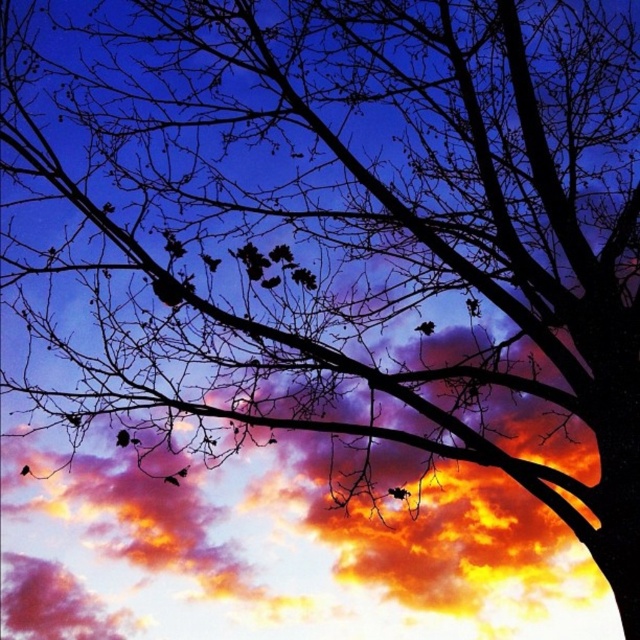
Is black matte bird at center taller than silhouette feather at lower left?

Yes.

Find the location of a particular element. black matte bird at center is located at coordinates (426, 326).

Find the location of a particular element. This screenshot has height=640, width=640. black matte bird at center is located at coordinates (426, 326).